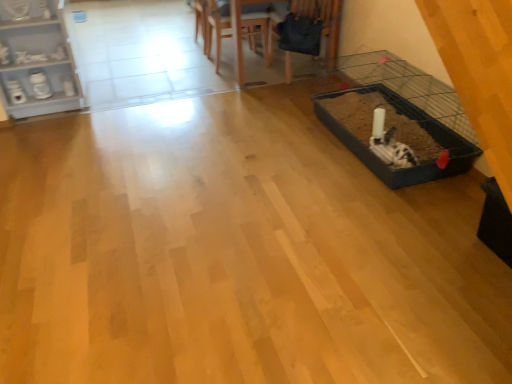
Question: Is wooden chair at upper center, positioned as the first armchair in left-to-right order, oriented away from wooden chair at upper center, which is the 2th armchair in right-to-left order?

Choices:
 (A) yes
 (B) no

Answer: (B)

Question: Considering the relative sizes of wooden chair at upper center, positioned as the 3th armchair in right-to-left order, and wooden chair at upper center, which is the 2th armchair in right-to-left order, in the image provided, is wooden chair at upper center, positioned as the 3th armchair in right-to-left order, bigger than wooden chair at upper center, which is the 2th armchair in right-to-left order,?

Choices:
 (A) yes
 (B) no

Answer: (B)

Question: Can you confirm if wooden chair at upper center, positioned as the first armchair in left-to-right order, is positioned to the left of wooden chair at upper center, which ranks as the 2th armchair in left-to-right order?

Choices:
 (A) no
 (B) yes

Answer: (B)

Question: Can you confirm if wooden chair at upper center, positioned as the 3th armchair in right-to-left order, is taller than wooden chair at upper center, which ranks as the 2th armchair in left-to-right order?

Choices:
 (A) no
 (B) yes

Answer: (A)

Question: From a real-world perspective, is wooden chair at upper center, positioned as the 3th armchair in right-to-left order, positioned under wooden chair at upper center, which is the 2th armchair in right-to-left order, based on gravity?

Choices:
 (A) yes
 (B) no

Answer: (A)

Question: In the image, is velvet dark blue armchair at upper center, which ranks as the third armchair in left-to-right order, positioned in front of or behind wooden table at upper center?

Choices:
 (A) front
 (B) behind

Answer: (B)

Question: From a real-world perspective, is velvet dark blue armchair at upper center, acting as the first armchair starting from the right, physically located above or below wooden table at upper center?

Choices:
 (A) above
 (B) below

Answer: (B)

Question: Choose the correct answer: Is velvet dark blue armchair at upper center, acting as the first armchair starting from the right, inside wooden table at upper center or outside it?

Choices:
 (A) outside
 (B) inside

Answer: (B)

Question: In terms of width, does velvet dark blue armchair at upper center, which ranks as the third armchair in left-to-right order, look wider or thinner when compared to wooden table at upper center?

Choices:
 (A) wide
 (B) thin

Answer: (B)

Question: Based on their positions, is wooden table at upper center located to the left or right of white painted wood shelf at upper left?

Choices:
 (A) right
 (B) left

Answer: (A)

Question: Looking at the image, does wooden table at upper center seem bigger or smaller compared to white painted wood shelf at upper left?

Choices:
 (A) small
 (B) big

Answer: (B)

Question: Considering their positions, is wooden table at upper center located in front of or behind white painted wood shelf at upper left?

Choices:
 (A) behind
 (B) front

Answer: (A)

Question: Is wooden table at upper center inside or outside of white painted wood shelf at upper left?

Choices:
 (A) outside
 (B) inside

Answer: (A)

Question: Is wooden chair at upper center, positioned as the 3th armchair in right-to-left order, inside or outside of wooden table at upper center?

Choices:
 (A) outside
 (B) inside

Answer: (B)

Question: Based on their sizes in the image, would you say wooden chair at upper center, positioned as the first armchair in left-to-right order, is bigger or smaller than wooden table at upper center?

Choices:
 (A) small
 (B) big

Answer: (A)